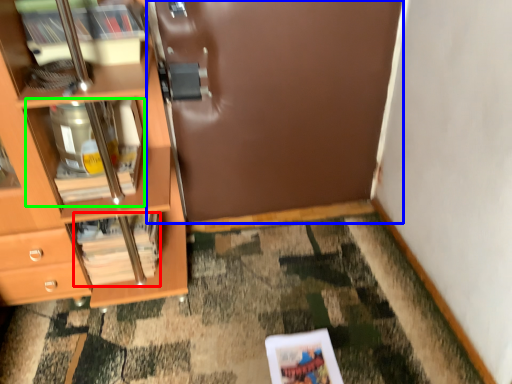
Question: Estimate the real-world distances between objects in this image. Which object is farther from magazine (highlighted by a red box), door (highlighted by a blue box) or cabinet (highlighted by a green box)?

Choices:
 (A) door
 (B) cabinet

Answer: (A)